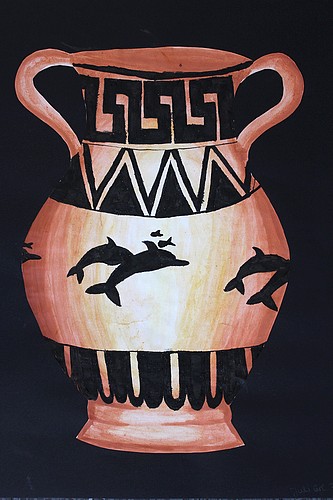
This screenshot has width=333, height=500. In order to click on top of urn in this screenshot , I will do `click(166, 57)`.